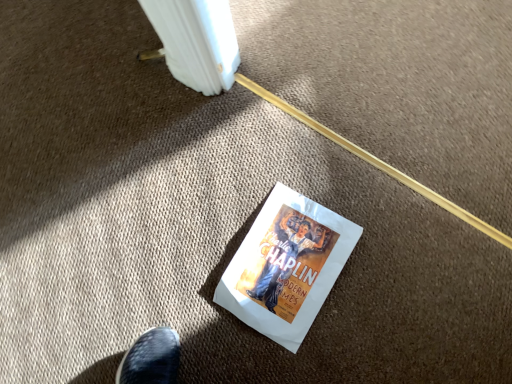
Identify the location of white paper at center. This screenshot has height=384, width=512. (286, 266).

Describe the element at coordinates (286, 266) in the screenshot. I see `white paper at center` at that location.

Identify the location of white paper at center. The height and width of the screenshot is (384, 512). [286, 266].